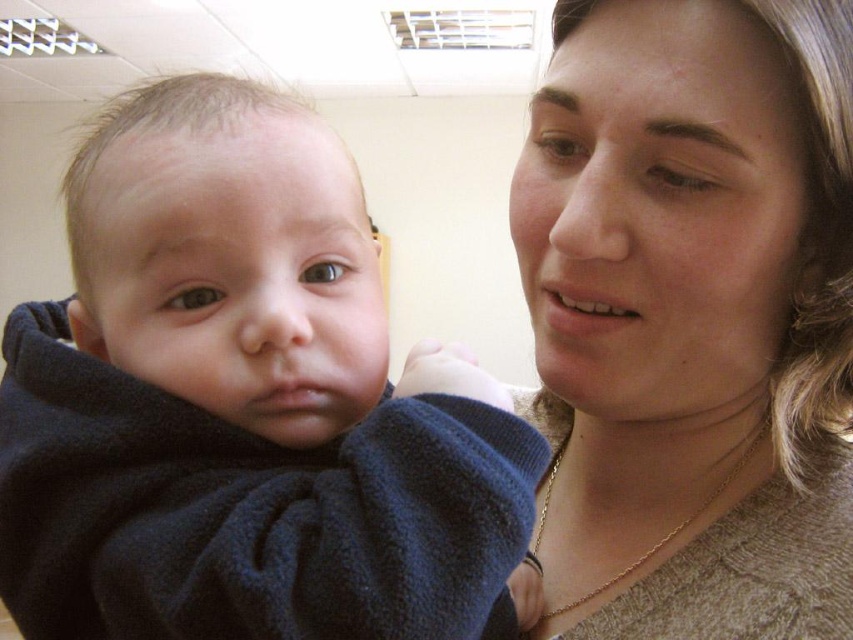
Question: Does dark blue fleece at center have a lesser width compared to matte beige sweater at center?

Choices:
 (A) yes
 (B) no

Answer: (B)

Question: Which object appears farthest from the camera in this image?

Choices:
 (A) matte beige sweater at center
 (B) dark blue fleece at center

Answer: (A)

Question: From the image, what is the correct spatial relationship of dark blue fleece at center in relation to matte beige sweater at center?

Choices:
 (A) left
 (B) right

Answer: (A)

Question: Which object appears farthest from the camera in this image?

Choices:
 (A) matte beige sweater at center
 (B) dark blue fleece at center

Answer: (A)

Question: Which of the following is the closest to the observer?

Choices:
 (A) matte beige sweater at center
 (B) dark blue fleece at center

Answer: (B)

Question: Observing the image, what is the correct spatial positioning of dark blue fleece at center in reference to matte beige sweater at center?

Choices:
 (A) below
 (B) above

Answer: (A)